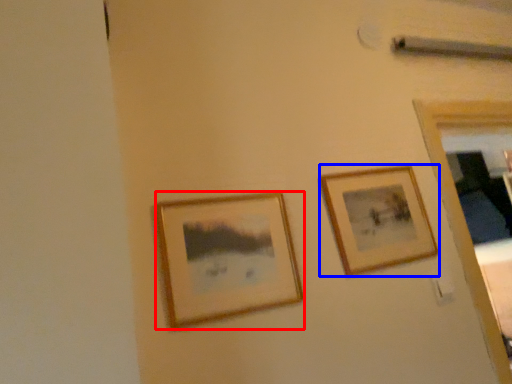
Question: Which object appears closest to the camera in this image, picture frame (highlighted by a red box) or picture frame (highlighted by a blue box)?

Choices:
 (A) picture frame
 (B) picture frame

Answer: (A)